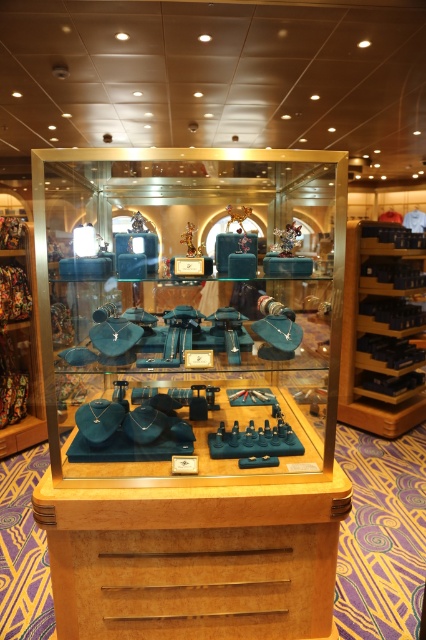
Question: Does matte blue jewelry box at center have a greater width compared to matte blue figurine at center?

Choices:
 (A) yes
 (B) no

Answer: (B)

Question: Among these objects, which one is farthest from the camera?

Choices:
 (A) matte blue figurine at center
 (B) matte blue jewelry box at center

Answer: (A)

Question: Which point is farther to the camera?

Choices:
 (A) matte blue figurine at center
 (B) matte blue jewelry box at center

Answer: (A)

Question: Which object is farther from the camera taking this photo?

Choices:
 (A) matte blue jewelry box at center
 (B) matte blue figurine at center

Answer: (B)

Question: Does matte blue jewelry box at center appear under matte blue figurine at center?

Choices:
 (A) no
 (B) yes

Answer: (B)

Question: Does matte blue jewelry box at center have a smaller size compared to matte blue figurine at center?

Choices:
 (A) no
 (B) yes

Answer: (B)